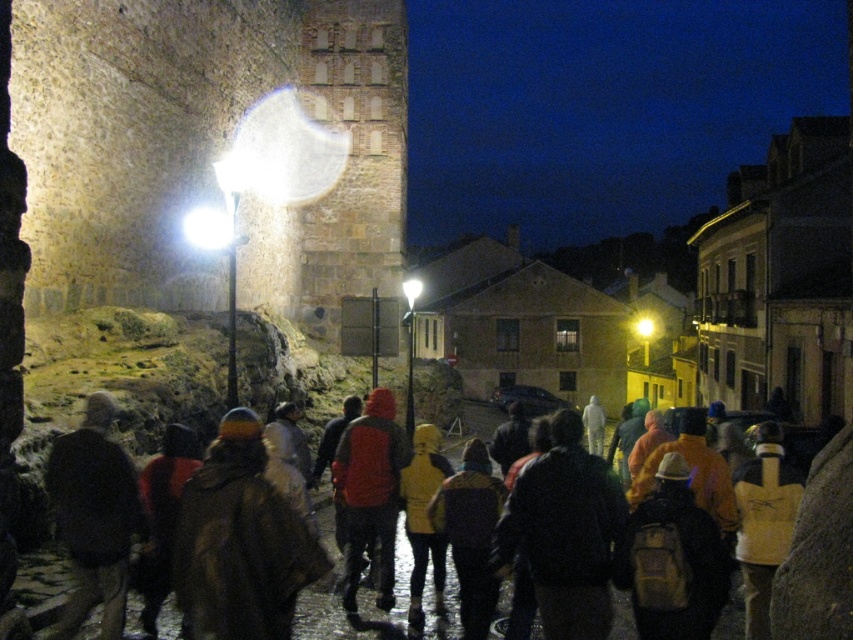
Question: Estimate the real-world distances between objects in this image. Which object is farther from the brown fuzzy coat at lower left?

Choices:
 (A) black fabric jacket at lower left
 (B) red matte jacket at center
 (C) brick textured tower at center
 (D) brown textured jacket at center

Answer: (C)

Question: Can you confirm if brick textured tower at center is bigger than brown fuzzy coat at lower left?

Choices:
 (A) no
 (B) yes

Answer: (B)

Question: Which point is closer to the camera?

Choices:
 (A) brown fuzzy coat at lower left
 (B) brick textured tower at center
 (C) red matte jacket at center
 (D) brown textured jacket at center

Answer: (A)

Question: Does brown textured jacket at center appear over red matte jacket at center?

Choices:
 (A) yes
 (B) no

Answer: (B)

Question: Can you confirm if brown fuzzy coat at lower left is bigger than brown textured jacket at center?

Choices:
 (A) no
 (B) yes

Answer: (A)

Question: Which point appears closest to the camera in this image?

Choices:
 (A) (250, 556)
 (B) (71, 492)
 (C) (306, 44)

Answer: (A)